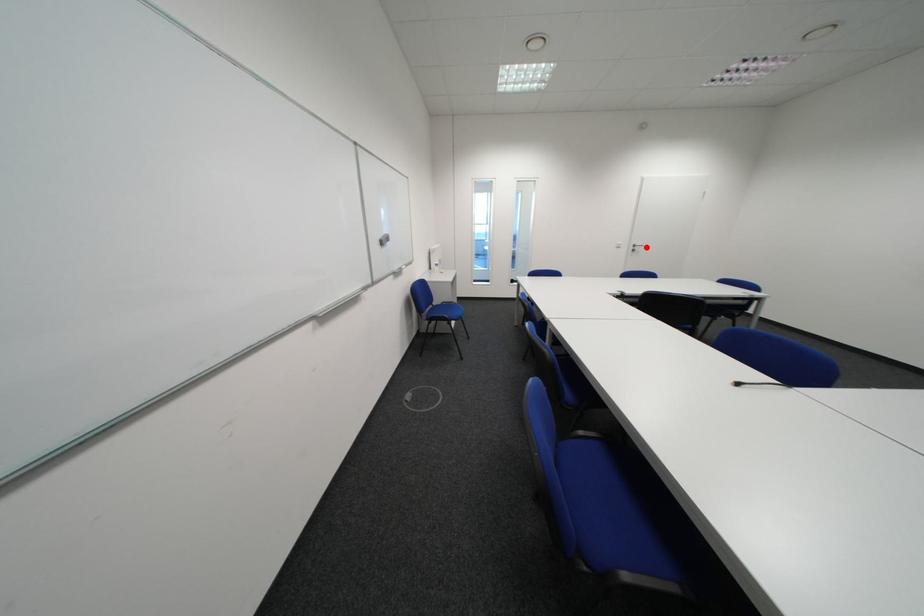
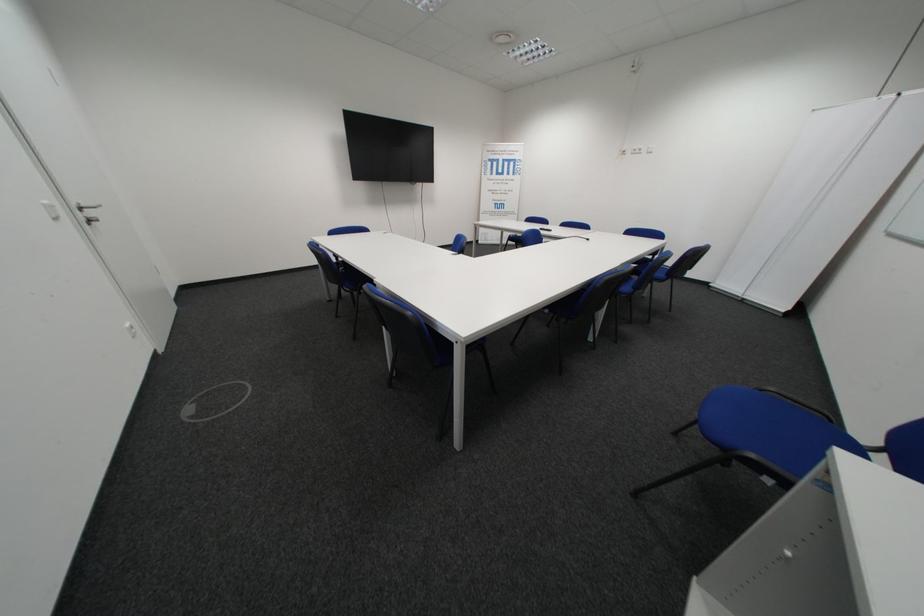
Where in the second image is the point corresponding to the highlighted location from the first image?

(93, 209)